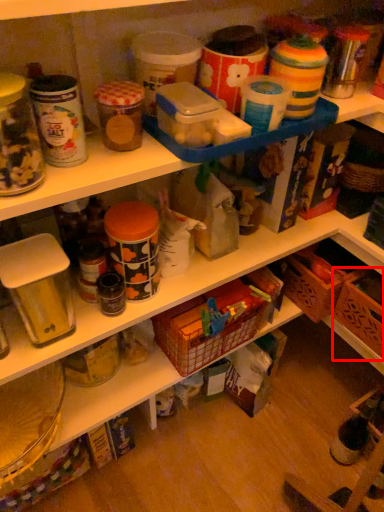
Question: From the image's perspective, what is the correct spatial relationship of basket (annotated by the red box) in relation to basket?

Choices:
 (A) above
 (B) below

Answer: (A)